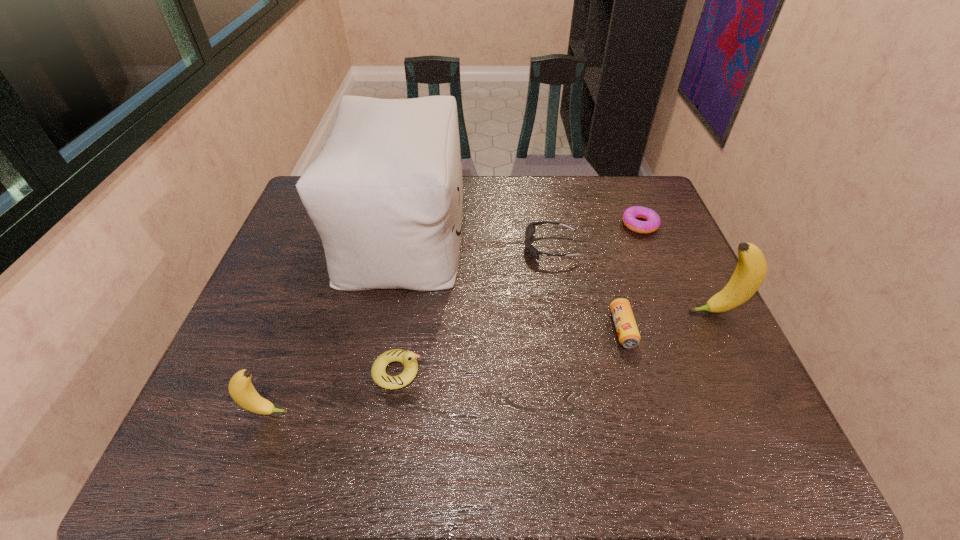
I want to click on vacant space at the far edge, so click(491, 195).

You are a GUI agent. You are given a task and a screenshot of the screen. Output one action in this format:
    pyautogui.click(x=<x>, y=<y>)
    Task: Click on the vacant space at the near edge
    
    Given the screenshot: What is the action you would take?
    pyautogui.click(x=557, y=403)

In the image, there is a desktop. In order to click on vacant space at the left edge in this screenshot , I will do `click(285, 254)`.

In the image, there is a desktop. Find the location of `vacant space at the right edge`. vacant space at the right edge is located at coordinates (x=683, y=293).

Locate an element on the screen. The width and height of the screenshot is (960, 540). free location at the far right corner is located at coordinates (640, 179).

The image size is (960, 540). I want to click on vacant space at the near right corner of the desktop, so click(x=734, y=413).

Where is `vacant area that lies between the beer can and the goggles`? vacant area that lies between the beer can and the goggles is located at coordinates (587, 288).

Find the location of a particular element. The width and height of the screenshot is (960, 540). empty space that is in between the shortest object and the right banana is located at coordinates pos(677,268).

In order to click on free space between the cushion and the right banana in this screenshot , I will do `click(559, 273)`.

Identify the location of vacant region between the duckling and the tallest object. (400, 302).